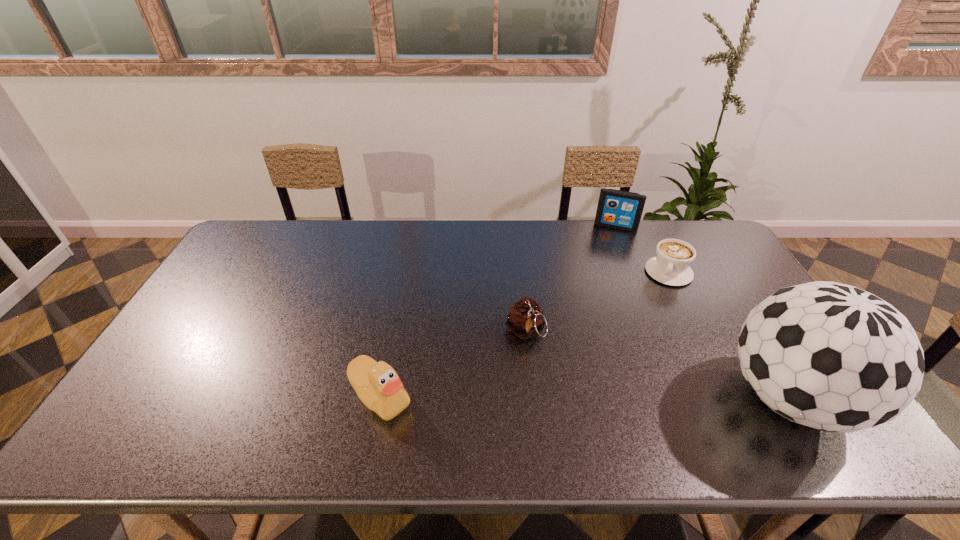
Where is `duck`? The width and height of the screenshot is (960, 540). duck is located at coordinates (378, 386).

Identify the location of the tallest object. The height and width of the screenshot is (540, 960). (830, 356).

The image size is (960, 540). What are the coordinates of `the second shortest object` in the screenshot? It's located at (525, 320).

The image size is (960, 540). I want to click on the second object from left to right, so click(525, 320).

Locate an element on the screen. This screenshot has height=540, width=960. the shortest object is located at coordinates click(673, 257).

The image size is (960, 540). I want to click on cappuccino, so click(673, 257).

At what (x,y) coordinates should I click in order to perform the action: click on iPod. Please return your answer as a coordinate pair (x, y). The height and width of the screenshot is (540, 960). Looking at the image, I should click on (618, 209).

You are a GUI agent. You are given a task and a screenshot of the screen. Output one action in this format:
    pyautogui.click(x=<x>, y=<y>)
    Task: Click on the free space located on the left of the tallest object
    
    Given the screenshot: What is the action you would take?
    pyautogui.click(x=606, y=398)

Image resolution: width=960 pixels, height=540 pixels. What are the coordinates of `vacant space located with a leaf charm attached to the pinecone` in the screenshot? It's located at (537, 373).

What are the coordinates of `free location located 0.180m with a leaf charm attached to the pinecone` in the screenshot? It's located at (547, 407).